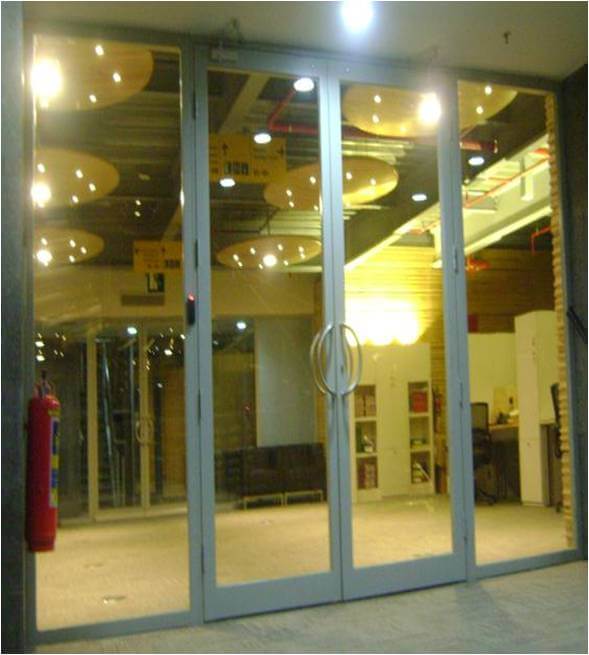
Where is `chair`? This screenshot has height=655, width=589. chair is located at coordinates (316, 475).